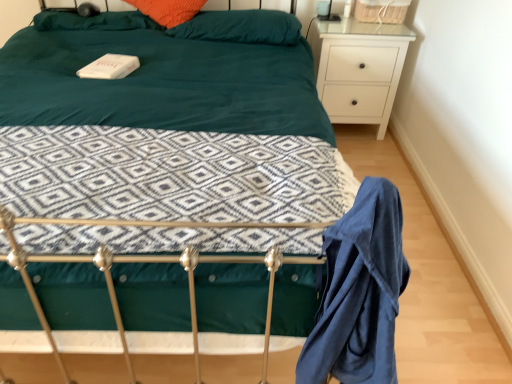
Question: Does point (42, 327) appear closer or farther from the camera than point (216, 13)?

Choices:
 (A) closer
 (B) farther

Answer: (A)

Question: From a real-world perspective, relative to teal fabric pillow at upper center, positioned as the 2th pillow in left-to-right order, is teal fabric bed at center vertically above or below?

Choices:
 (A) above
 (B) below

Answer: (B)

Question: Which of these objects is positioned farthest from the teal fabric bed at center?

Choices:
 (A) white matte nightstand at upper right
 (B) blue cotton robe at lower right
 (C) orange fabric pillow at upper center, the 1th pillow viewed from the left
 (D) teal fabric pillow at upper center, arranged as the first pillow when viewed from the right

Answer: (A)

Question: Estimate the real-world distances between objects in this image. Which object is closer to the teal fabric bed at center?

Choices:
 (A) teal fabric pillow at upper center, positioned as the 2th pillow in left-to-right order
 (B) blue cotton robe at lower right
 (C) orange fabric pillow at upper center, the 1th pillow viewed from the left
 (D) white matte nightstand at upper right

Answer: (B)